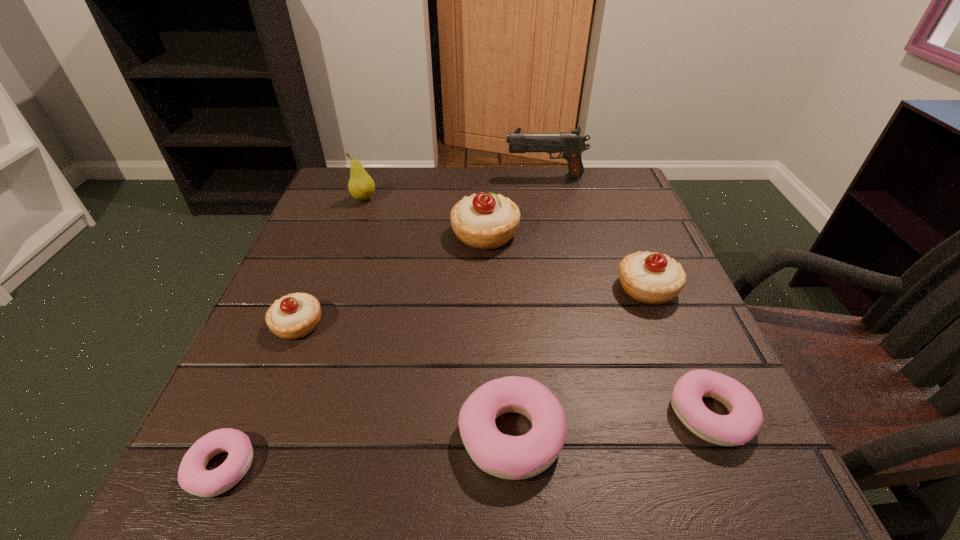
Locate an element on the screen. The height and width of the screenshot is (540, 960). the farthest object is located at coordinates [x=571, y=144].

Identify the location of gun. The image size is (960, 540). (571, 144).

Identify the location of pear. Image resolution: width=960 pixels, height=540 pixels. (361, 186).

Where is `the third farthest object`? This screenshot has height=540, width=960. the third farthest object is located at coordinates (485, 221).

Image resolution: width=960 pixels, height=540 pixels. I want to click on the third tallest object, so click(x=485, y=221).

Where is `the fifth shortest object`? Image resolution: width=960 pixels, height=540 pixels. the fifth shortest object is located at coordinates coord(652,278).

Identify the location of the rightmost beige pastry. (652, 278).

This screenshot has height=540, width=960. Identify the location of the leftmost beige pastry. (293, 316).

What are the coordinates of `the fourth shortest pastry` in the screenshot? It's located at (293, 316).

The height and width of the screenshot is (540, 960). Find the location of `the third shortest object`. the third shortest object is located at coordinates (509, 457).